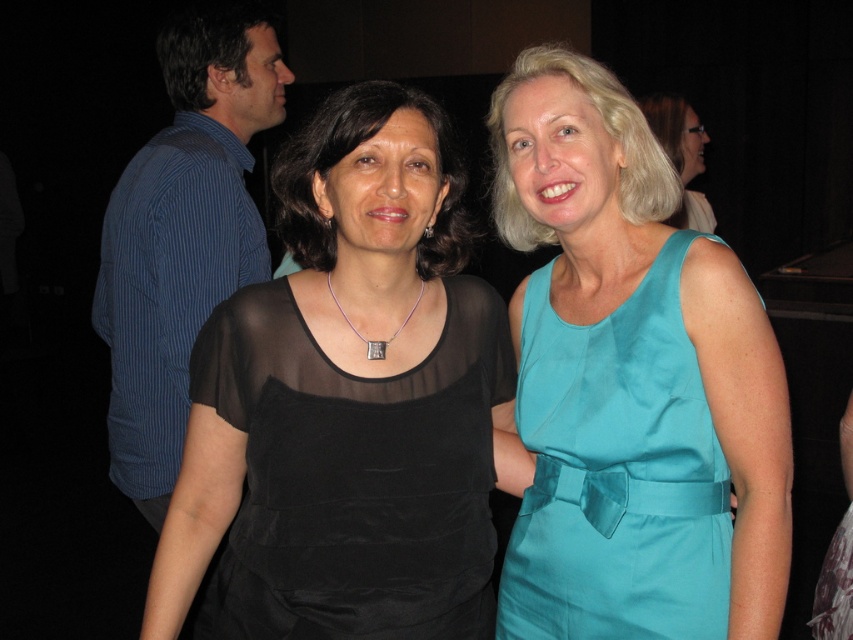
Question: Is teal satin dress at right behind teal satin dress at upper right?

Choices:
 (A) yes
 (B) no

Answer: (B)

Question: Which point is farther to the camera?

Choices:
 (A) (x=399, y=323)
 (B) (x=660, y=96)
 (C) (x=554, y=513)

Answer: (B)

Question: Can you confirm if teal satin dress at right is positioned above teal satin dress at upper right?

Choices:
 (A) yes
 (B) no

Answer: (B)

Question: Considering the relative positions of sheer black dress at center and teal satin dress at upper right in the image provided, where is sheer black dress at center located with respect to teal satin dress at upper right?

Choices:
 (A) left
 (B) right

Answer: (A)

Question: Which point is closer to the camera?

Choices:
 (A) silver metallic square at center
 (B) teal satin dress at right

Answer: (B)

Question: Which point is closer to the camera taking this photo?

Choices:
 (A) coord(677,150)
 (B) coord(386,344)
 (C) coord(665,449)

Answer: (C)